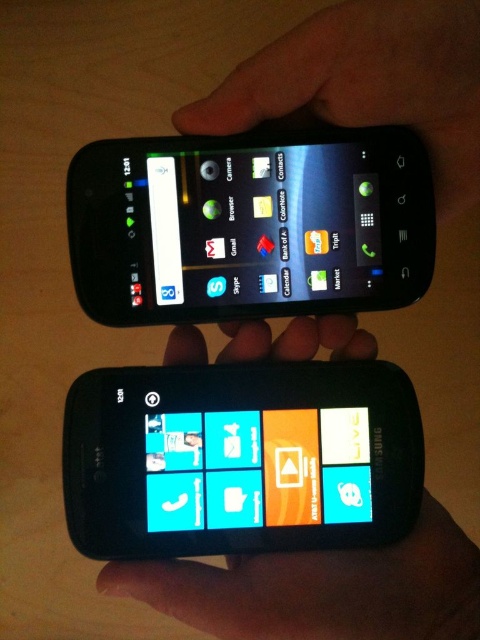
Does matte black smartphone at center appear on the left side of matte black smartphone at upper center?

Yes, matte black smartphone at center is to the left of matte black smartphone at upper center.

Is matte black smartphone at center positioned before matte black smartphone at upper center?

No, it is not.

What do you see at coordinates (240, 458) in the screenshot? This screenshot has width=480, height=640. I see `matte black smartphone at center` at bounding box center [240, 458].

The width and height of the screenshot is (480, 640). In order to click on matte black smartphone at center in this screenshot , I will do `click(240, 458)`.

How far apart are matte black smartphone at upper center and matte plastic phone at upper center?

matte black smartphone at upper center and matte plastic phone at upper center are 7.50 inches apart from each other.

Is matte black smartphone at upper center bigger than matte plastic phone at upper center?

Yes.

Who is more forward, (370, 252) or (218, 438)?

Point (370, 252) is more forward.

Identify the location of matte black smartphone at upper center. The width and height of the screenshot is (480, 640). (250, 225).

The width and height of the screenshot is (480, 640). Describe the element at coordinates (250, 225) in the screenshot. I see `matte black smartphone at upper center` at that location.

Between point (69, 244) and point (443, 10), which one is positioned behind?

The point (69, 244) is more distant.

Between point (175, 170) and point (408, 88), which one is positioned behind?

Point (175, 170)

Identify the location of matte black smartphone at upper center. (250, 225).